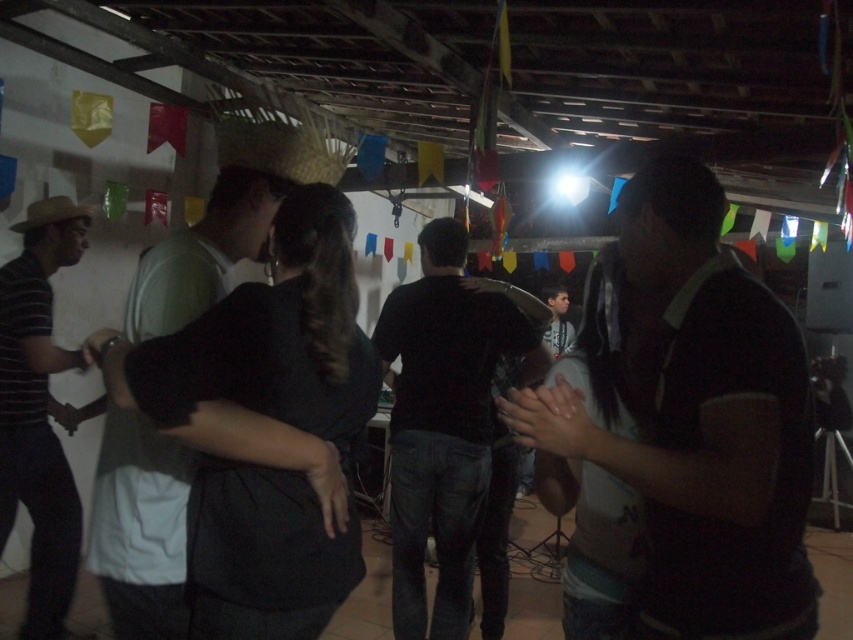
You are a photographer at the party and want to capture a photo of the dark green shirt at center and the straw hat at center. Which object should you focus on if you want to ensure the wider one is in focus?

The straw hat at center is wider than the dark green shirt at center, so you should focus on the straw hat at center to ensure the wider object is in focus.

Consider the image. You are at the lively indoor gathering and want to take a photo of both the point at coordinates point [141,580] and point [30,216]. Which point should you focus on first to ensure both are in clear view?

Point [141,580] is closer to the camera than point [30,216]. To ensure both are in clear view, focus on the closer point first, which is point [141,580].

You are at a party and want to know if the dark brown shirt at center is wider than the black matte shirt at center. Can you tell me which one is wider?

The dark brown shirt at center has a lesser width compared to black matte shirt at center, so the black matte shirt at center is wider.